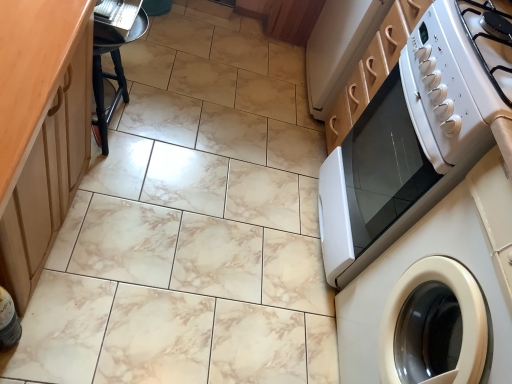
Question: Is white glossy microwave at right facing away from wooden at left?

Choices:
 (A) no
 (B) yes

Answer: (A)

Question: From a real-world perspective, is white glossy microwave at right under wooden at left?

Choices:
 (A) yes
 (B) no

Answer: (A)

Question: From a real-world perspective, is white glossy microwave at right on top of wooden at left?

Choices:
 (A) yes
 (B) no

Answer: (B)

Question: Is the position of white glossy microwave at right more distant than that of wooden at left?

Choices:
 (A) yes
 (B) no

Answer: (A)

Question: Is white glossy microwave at right smaller than wooden at left?

Choices:
 (A) no
 (B) yes

Answer: (B)

Question: Does point (371, 168) appear closer or farther from the camera than point (55, 49)?

Choices:
 (A) closer
 (B) farther

Answer: (B)

Question: Visually, is white glossy microwave at right positioned to the left or to the right of wooden at left?

Choices:
 (A) left
 (B) right

Answer: (B)

Question: From a real-world perspective, is white glossy microwave at right positioned above or below wooden at left?

Choices:
 (A) below
 (B) above

Answer: (A)

Question: In the image, is white glossy microwave at right positioned in front of or behind wooden at left?

Choices:
 (A) behind
 (B) front

Answer: (A)

Question: In terms of height, does white glossy washing machine at right look taller or shorter compared to white glossy microwave at right?

Choices:
 (A) short
 (B) tall

Answer: (B)

Question: From a real-world perspective, relative to white glossy microwave at right, is white glossy washing machine at right vertically above or below?

Choices:
 (A) below
 (B) above

Answer: (B)

Question: Is white glossy washing machine at right in front of or behind white glossy microwave at right in the image?

Choices:
 (A) behind
 (B) front

Answer: (B)

Question: Is white glossy washing machine at right wider or thinner than white glossy microwave at right?

Choices:
 (A) wide
 (B) thin

Answer: (A)

Question: Is white glossy microwave at right in front of or behind black wood bar stool at left in the image?

Choices:
 (A) behind
 (B) front

Answer: (B)

Question: Visually, is white glossy microwave at right positioned to the left or to the right of black wood bar stool at left?

Choices:
 (A) right
 (B) left

Answer: (A)